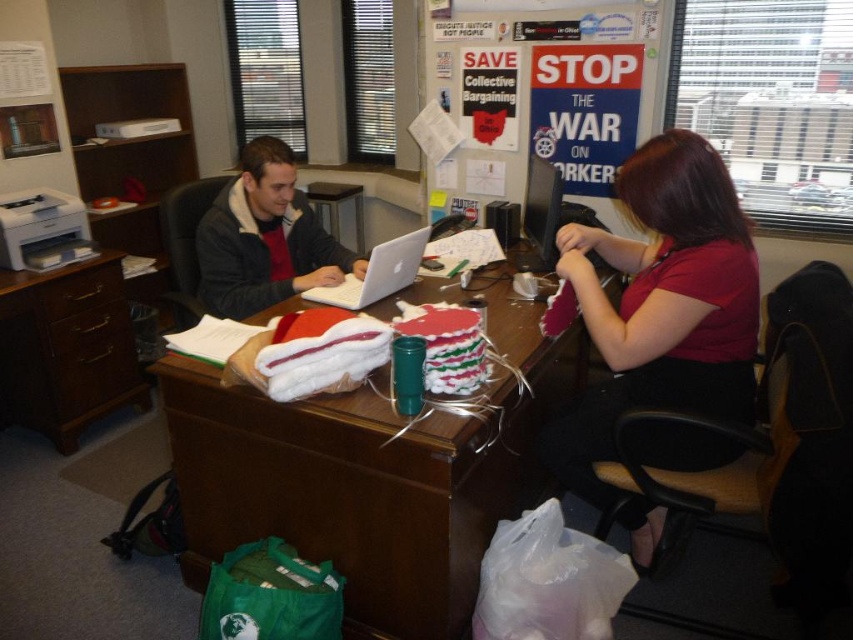
Can you confirm if wooden at center is positioned above dark gray jacket at center?

Incorrect, wooden at center is not positioned above dark gray jacket at center.

Does point (437, 289) lie in front of point (312, 236)?

Yes, point (437, 289) is closer to viewer.

What are the coordinates of `wooden at center` in the screenshot? It's located at (372, 474).

Between matte red shirt at center and silver metallic laptop at center, which one is positioned higher?

silver metallic laptop at center is higher up.

Find the location of a particular element. The height and width of the screenshot is (640, 853). matte red shirt at center is located at coordinates (662, 304).

Can you confirm if matte red shirt at center is positioned below brown wood computer desk at left?

Incorrect, matte red shirt at center is not positioned below brown wood computer desk at left.

Can you confirm if matte red shirt at center is positioned to the right of brown wood computer desk at left?

Yes, matte red shirt at center is to the right of brown wood computer desk at left.

In order to click on matte red shirt at center in this screenshot , I will do `click(662, 304)`.

Identify the location of matte red shirt at center. (662, 304).